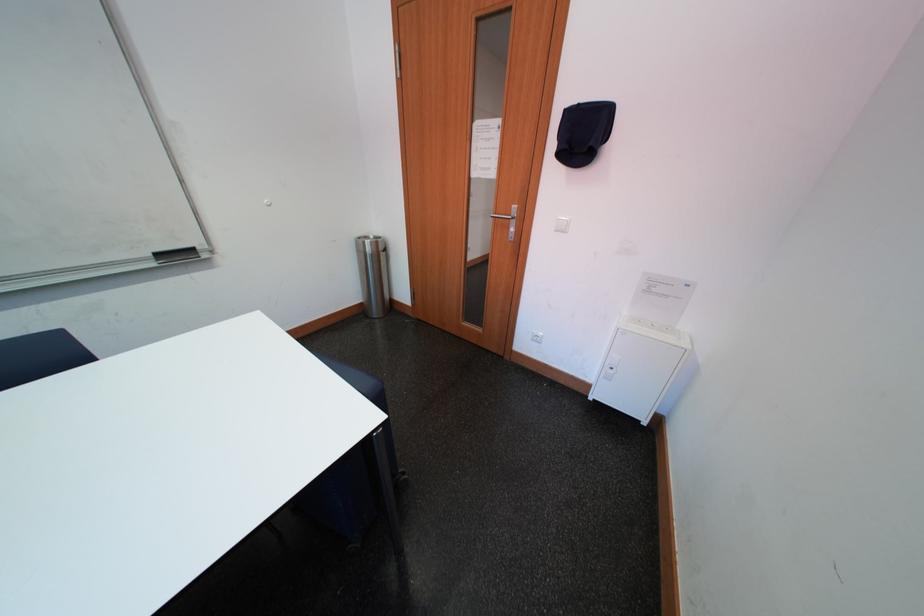
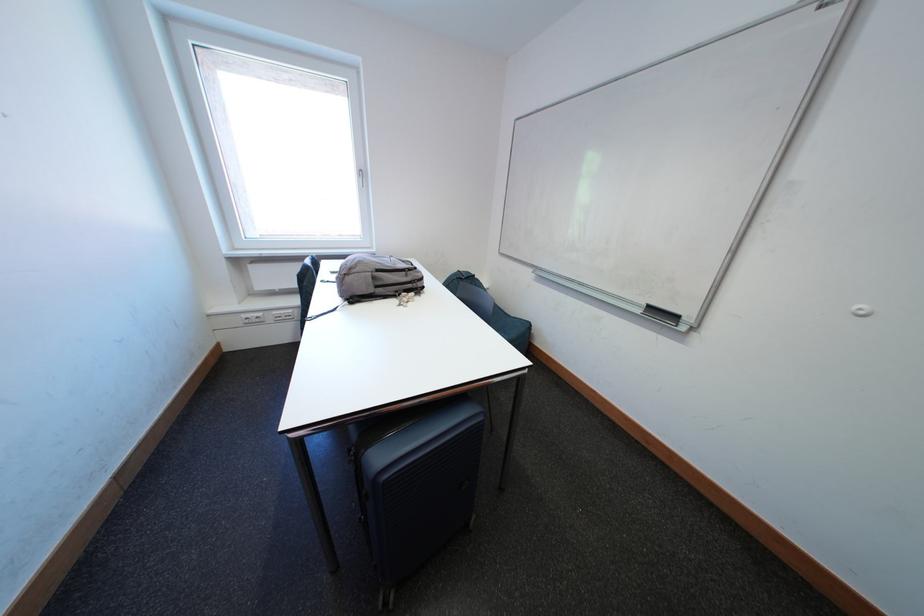
Based on the continuous images, in which direction is the camera rotating?

The camera's rotation is toward left-down.